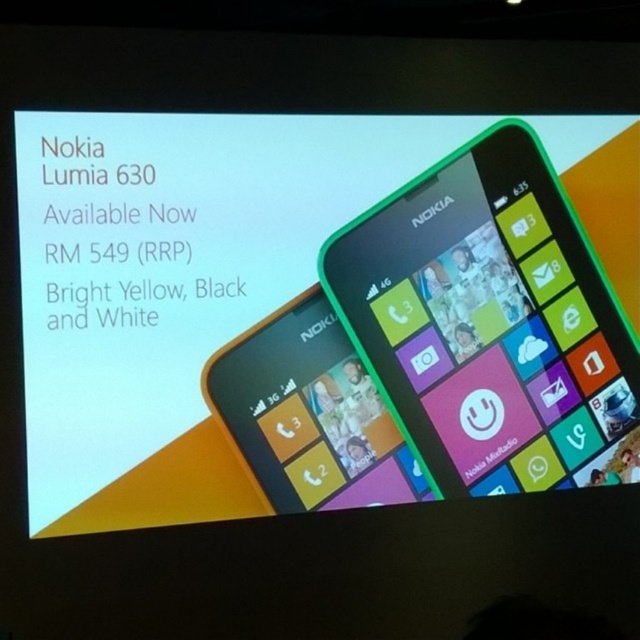
Question: Which object appears farthest from the camera in this image?

Choices:
 (A) bright yellow plastic nokia lumia 630 at upper right
 (B) green plastic nokia lumia 630 at right

Answer: (B)

Question: From the image, what is the correct spatial relationship of bright yellow plastic nokia lumia 630 at upper right in relation to green plastic nokia lumia 630 at right?

Choices:
 (A) above
 (B) below

Answer: (A)

Question: Does bright yellow plastic nokia lumia 630 at upper right appear on the right side of green plastic nokia lumia 630 at right?

Choices:
 (A) yes
 (B) no

Answer: (B)

Question: Which of the following is the closest to the observer?

Choices:
 (A) bright yellow plastic nokia lumia 630 at upper right
 (B) green plastic nokia lumia 630 at right

Answer: (A)

Question: Can you confirm if bright yellow plastic nokia lumia 630 at upper right is positioned to the left of green plastic nokia lumia 630 at right?

Choices:
 (A) yes
 (B) no

Answer: (A)